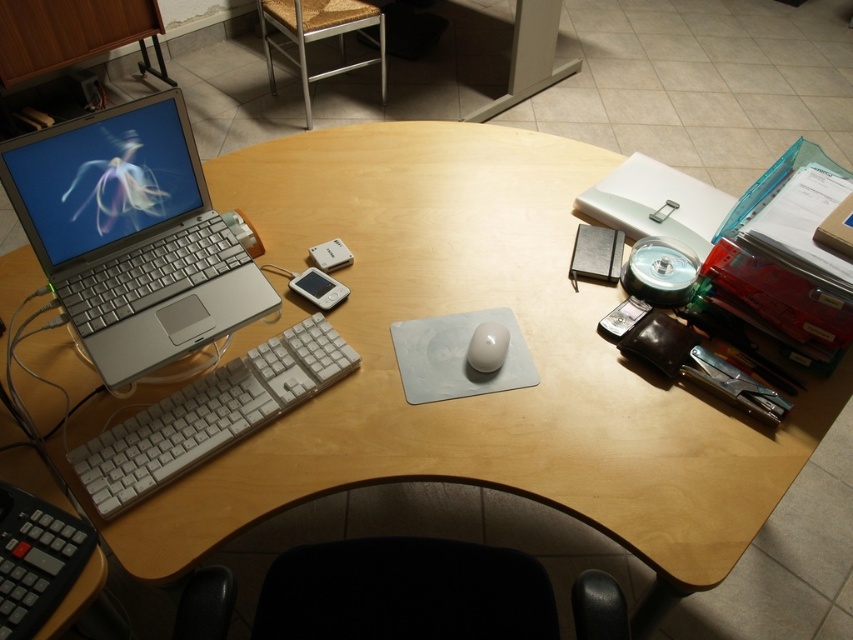
Question: Where is silver metallic laptop at left located in relation to white plastic keyboard at left in the image?

Choices:
 (A) below
 (B) above

Answer: (B)

Question: Which point is farther to the camera?

Choices:
 (A) (132, 433)
 (B) (221, 280)
 (C) (479, 342)

Answer: (C)

Question: Which point is closer to the camera taking this photo?

Choices:
 (A) (103, 236)
 (B) (483, 364)

Answer: (B)

Question: Observing the image, what is the correct spatial positioning of silver metallic laptop at left in reference to white plastic keyboard at left?

Choices:
 (A) above
 (B) below

Answer: (A)

Question: Which object is positioned closest to the white matte mouse at center?

Choices:
 (A) silver metallic laptop at left
 (B) white plastic keyboard at left

Answer: (B)

Question: Is white plastic keyboard at left positioned before white matte mouse at center?

Choices:
 (A) no
 (B) yes

Answer: (B)